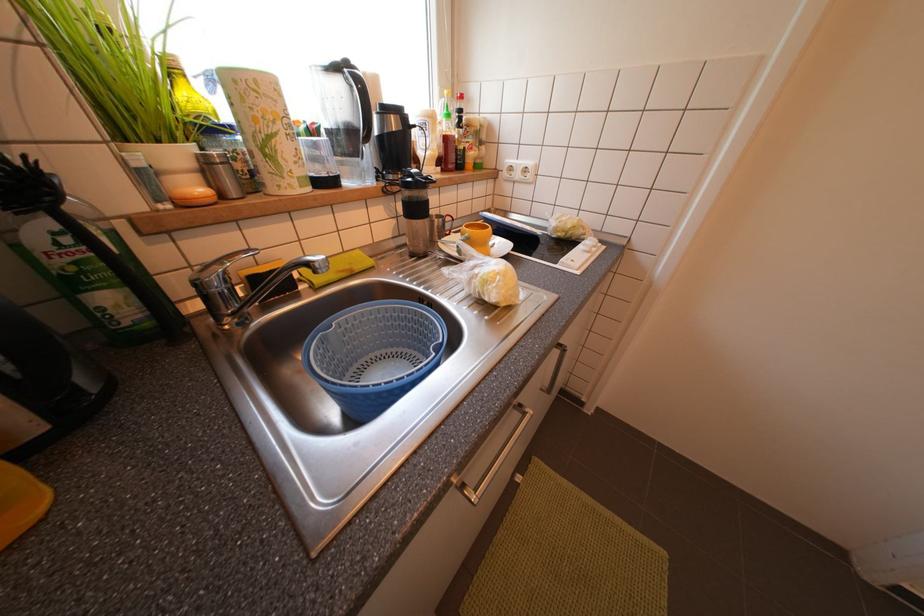
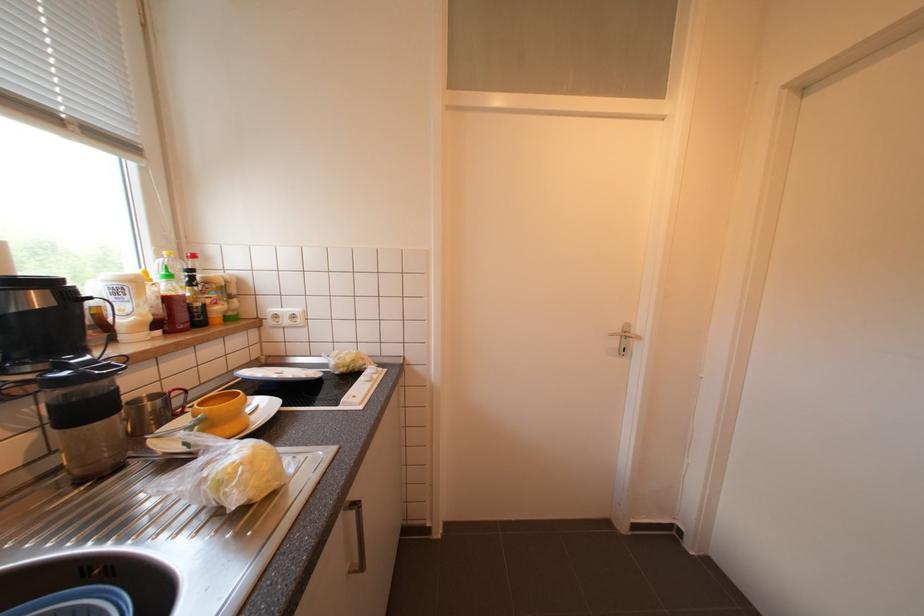
Based on the continuous images, in which direction is the camera rotating?

The rotation direction of the camera is right-up.